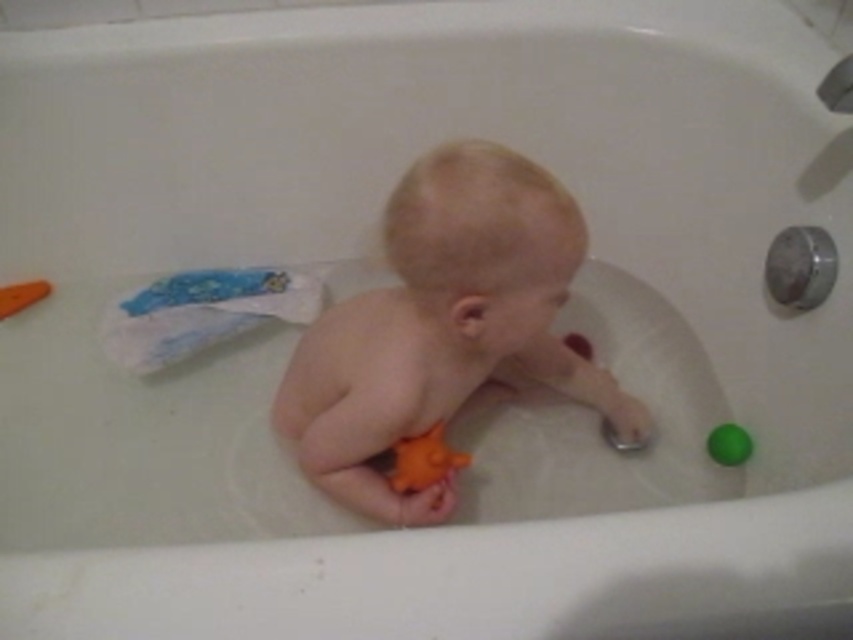
Is green rubber ball at right wider than orange rubber toy at left?

No, green rubber ball at right is not wider than orange rubber toy at left.

Does point (722, 445) come in front of point (0, 298)?

Yes, it is.

Does point (744, 454) lie behind point (36, 294)?

No, it is not.

Where is `green rubber ball at right`? The width and height of the screenshot is (853, 640). green rubber ball at right is located at coordinates (728, 444).

Measure the distance between point (363, 380) and camera.

Point (363, 380) is 32.30 inches away from camera.

Who is positioned more to the left, orange rubber toy at center or orange rubber toy at left?

Positioned to the left is orange rubber toy at left.

Between point (361, 360) and point (3, 300), which one is positioned behind?

Positioned behind is point (3, 300).

At what (x,y) coordinates should I click in order to perform the action: click on orange rubber toy at center. Please return your answer as a coordinate pair (x, y). This screenshot has width=853, height=640. Looking at the image, I should click on (444, 326).

Can you confirm if orange rubber starfish at center is shorter than orange rubber toy at left?

In fact, orange rubber starfish at center may be taller than orange rubber toy at left.

Measure the distance from orange rubber starfish at center to orange rubber toy at left.

28.97 inches

Locate an element on the screen. The height and width of the screenshot is (640, 853). orange rubber starfish at center is located at coordinates (424, 460).